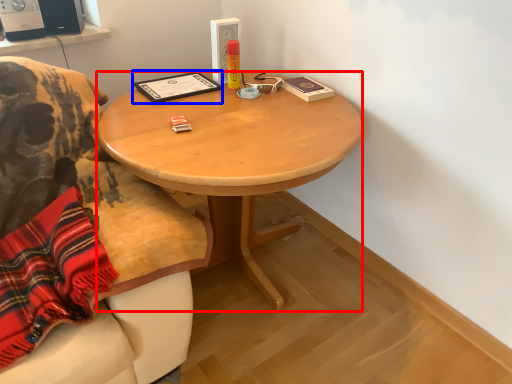
Question: Which object is closer to the camera taking this photo, desk (highlighted by a red box) or book (highlighted by a blue box)?

Choices:
 (A) desk
 (B) book

Answer: (A)